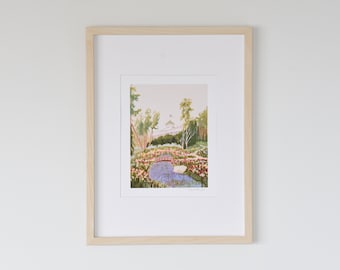
Locate an element on the screen. This screenshot has width=340, height=270. painting is located at coordinates (169, 143).